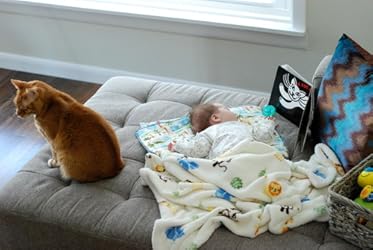
Identify the location of sofa. The image size is (373, 250). (141, 106).